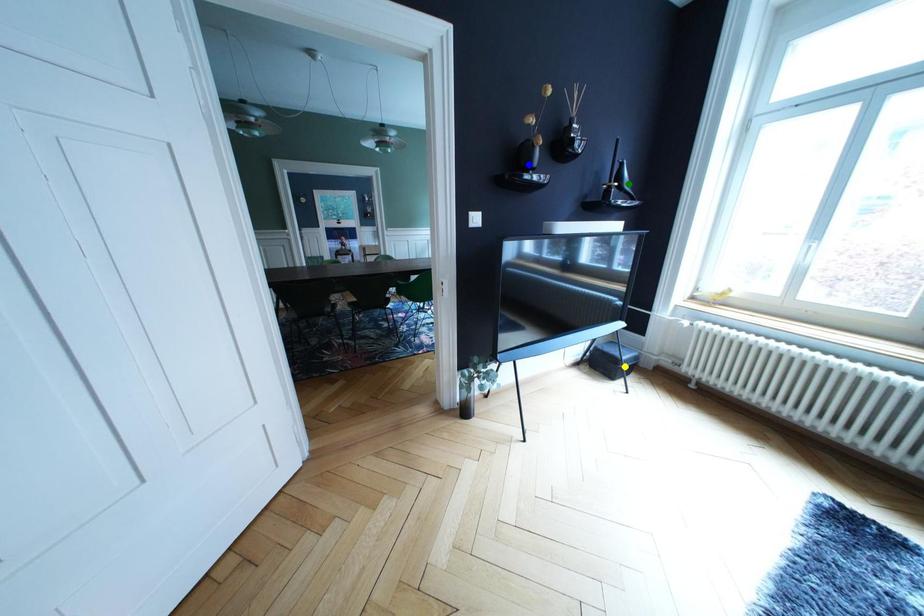
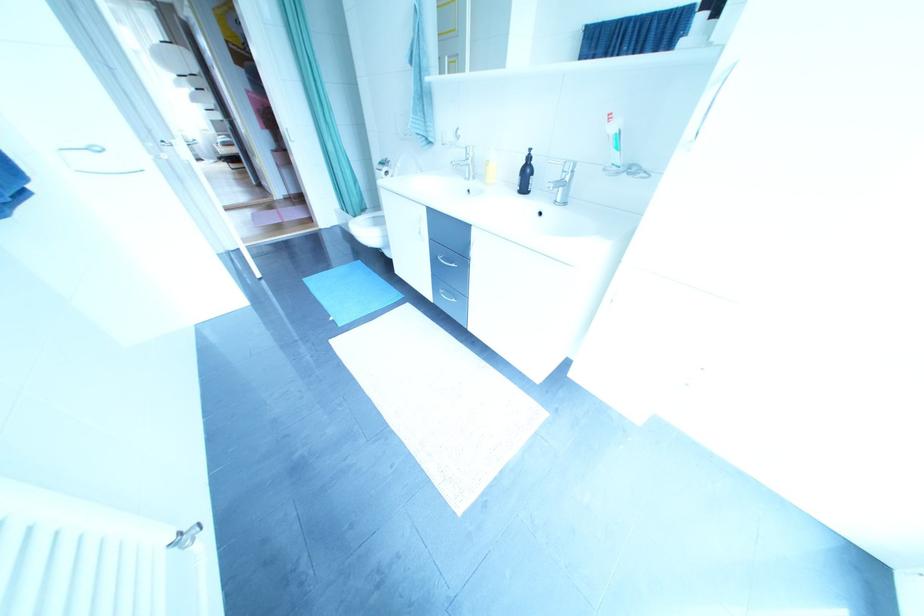
I am providing you with two images of the same scene from different viewpoints. Three points are marked in image1. Which point corresponds to a part or object that is occluded in image2?In image1, three points are marked. Which of them correspond to a part or object that is occluded in image2?Among the three points shown in image1, which one corresponds to a part or object that is no longer visible due to occlusion in image2?

Invisible in image2: green point, yellow point, blue point.